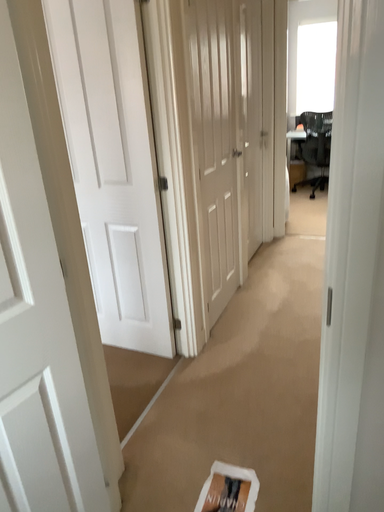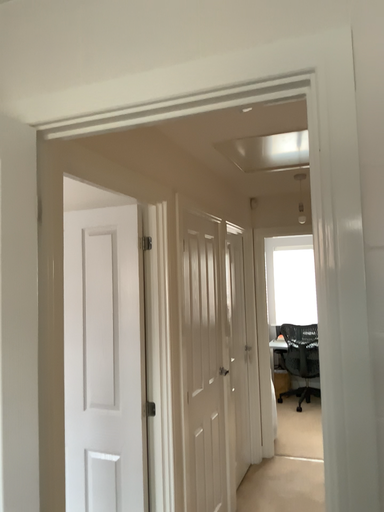
Question: Which way did the camera rotate in the video?

Choices:
 (A) rotated upward
 (B) rotated downward

Answer: (A)